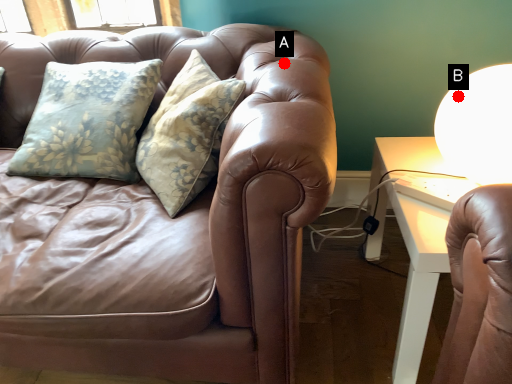
Question: Two points are circled on the image, labeled by A and B beside each circle. Among these points, which one is farthest from the camera?

Choices:
 (A) A is further
 (B) B is further

Answer: (A)